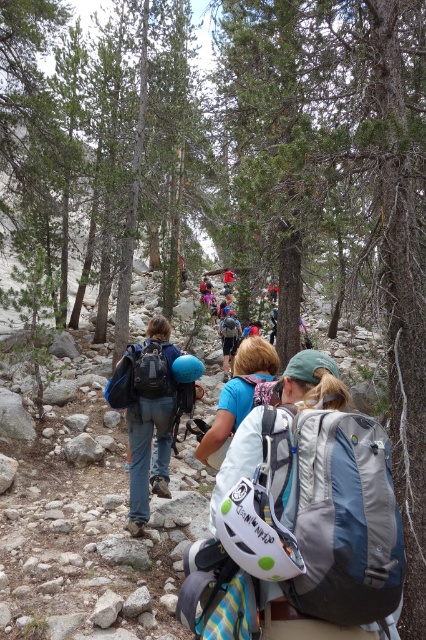
Question: Can you confirm if gray fabric backpack at center is thinner than matte black backpack at center?

Choices:
 (A) no
 (B) yes

Answer: (A)

Question: Which point appears farthest from the camera in this image?

Choices:
 (A) (235, 332)
 (B) (394, 593)

Answer: (A)

Question: Which point is closer to the camera?

Choices:
 (A) (235, 336)
 (B) (152, 339)
 (C) (267, 380)

Answer: (C)

Question: Which of the following is the closest to the observer?

Choices:
 (A) (367, 572)
 (B) (138, 362)
 (C) (244, 378)

Answer: (A)

Question: Is gray fabric backpack at center above blue fabric backpack at center?

Choices:
 (A) no
 (B) yes

Answer: (A)

Question: Does gray fabric backpack at center lie in front of matte black backpack at center?

Choices:
 (A) no
 (B) yes

Answer: (B)